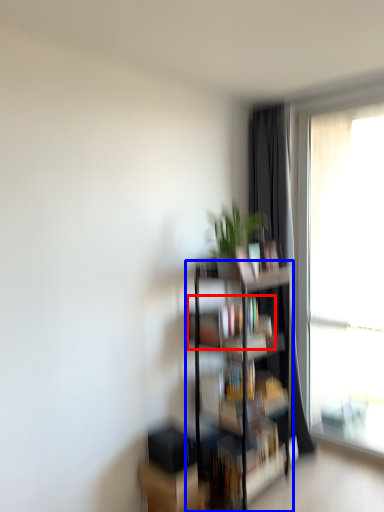
Question: Which point is closer to the camera, book (highlighted by a red box) or shelf (highlighted by a blue box)?

Choices:
 (A) book
 (B) shelf

Answer: (B)